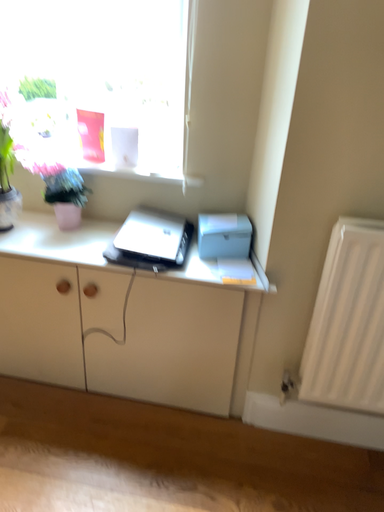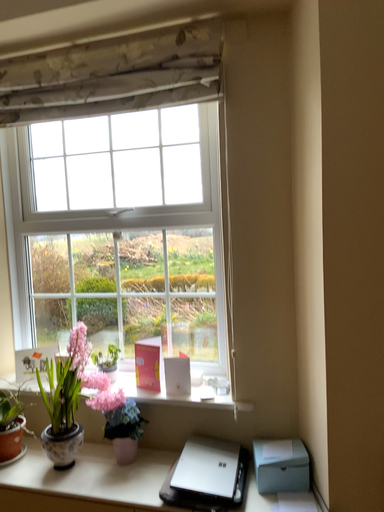
Question: How did the camera likely rotate when shooting the video?

Choices:
 (A) rotated right
 (B) rotated left

Answer: (B)